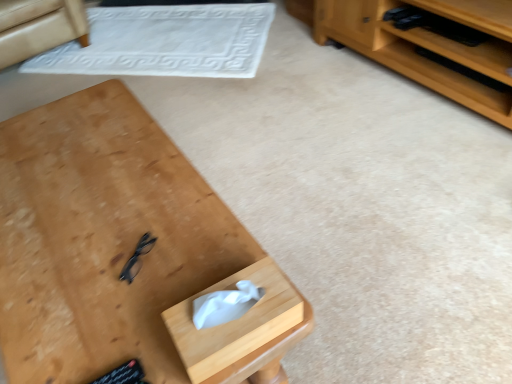
Identify the location of vacant area on the back side of wooden desk at center. This screenshot has height=384, width=512. 236,130.